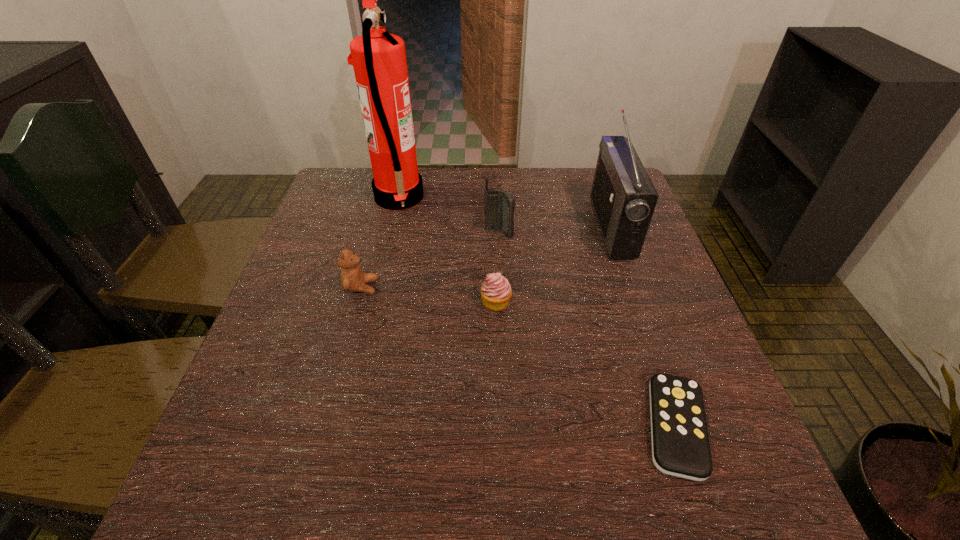
Identify the location of free space between the teddy bear and the fire extinguisher. click(x=380, y=242).

The image size is (960, 540). I want to click on empty space that is in between the tallest object and the cupcake, so click(447, 250).

Image resolution: width=960 pixels, height=540 pixels. Identify the location of free space between the shortest object and the teddy bear. (518, 357).

The width and height of the screenshot is (960, 540). Find the location of `blank region between the nearest object and the radio receiver`. blank region between the nearest object and the radio receiver is located at coordinates (644, 327).

Identify the location of vacant area between the teddy bear and the tallest object. This screenshot has height=540, width=960. (380, 242).

The image size is (960, 540). In order to click on free point between the teddy bear and the remote control in this screenshot , I will do `click(518, 357)`.

In order to click on empty location between the cupcake and the nearest object in this screenshot , I will do tap(586, 364).

You are a GUI agent. You are given a task and a screenshot of the screen. Output one action in this format:
    pyautogui.click(x=<x>, y=<y>)
    Task: Click on the free spot between the radio receiver and the fifth tallest object
    The image size is (960, 540).
    Given the screenshot: What is the action you would take?
    pyautogui.click(x=554, y=265)

Identify the location of free space between the teddy bear and the second tallest object. This screenshot has width=960, height=540. (487, 257).

Select which object appears as the third closest to the cellular telephone. Please provide its 2D coordinates. Your answer should be formatted as a tuple, i.e. [(x, y)], where the tuple contains the x and y coordinates of a point satisfying the conditions above.

[(623, 197)]